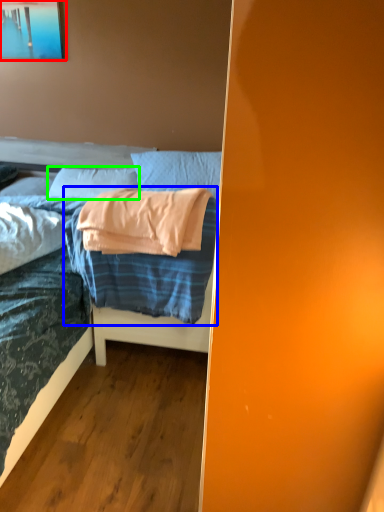
Question: Estimate the real-world distances between objects in this image. Which object is closer to picture frame (highlighted by a red box), blanket (highlighted by a blue box) or pillow (highlighted by a green box)?

Choices:
 (A) blanket
 (B) pillow

Answer: (B)